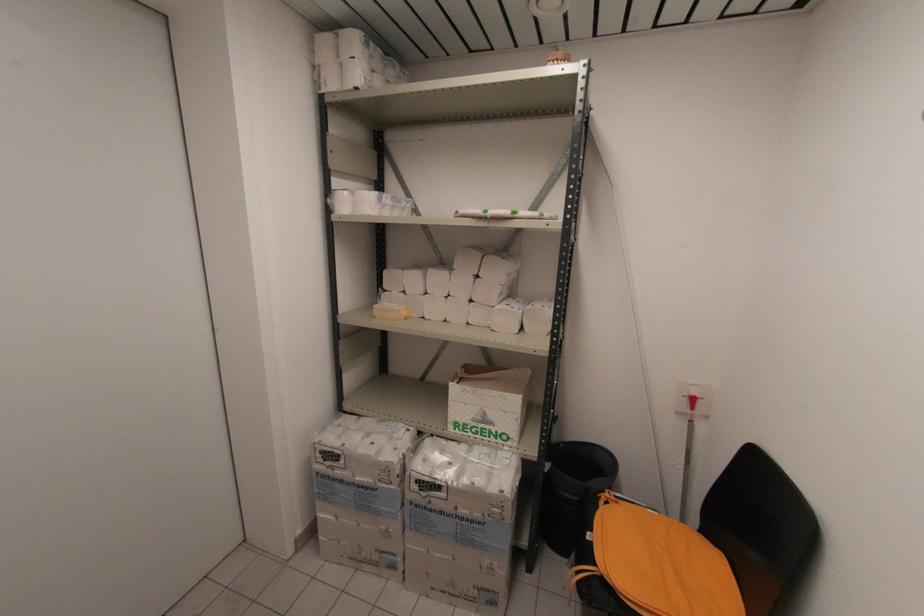
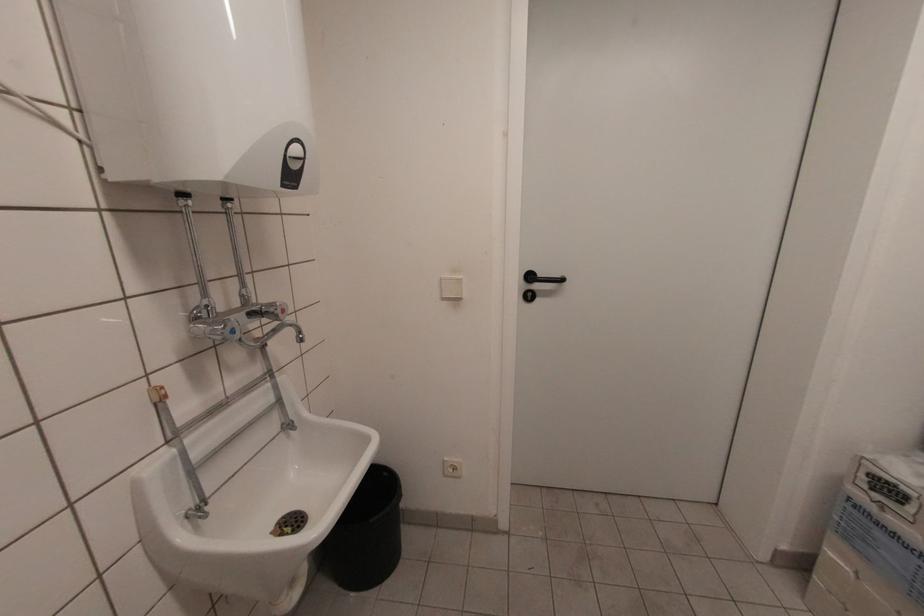
Question: The first image is from the beginning of the video and the second image is from the end. How did the camera likely rotate when shooting the video?

Choices:
 (A) Left
 (B) Right
 (C) Up
 (D) Down

Answer: (A)